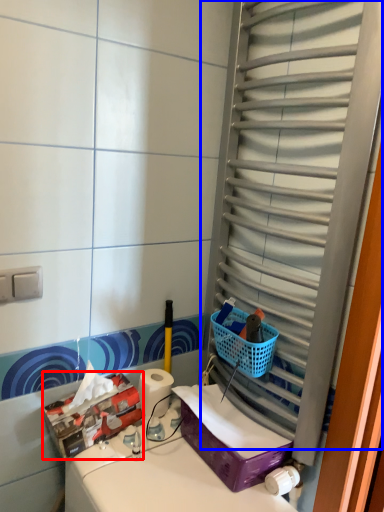
Question: Which object is closer to the camera taking this photo, storage box (highlighted by a red box) or glass door (highlighted by a blue box)?

Choices:
 (A) storage box
 (B) glass door

Answer: (B)